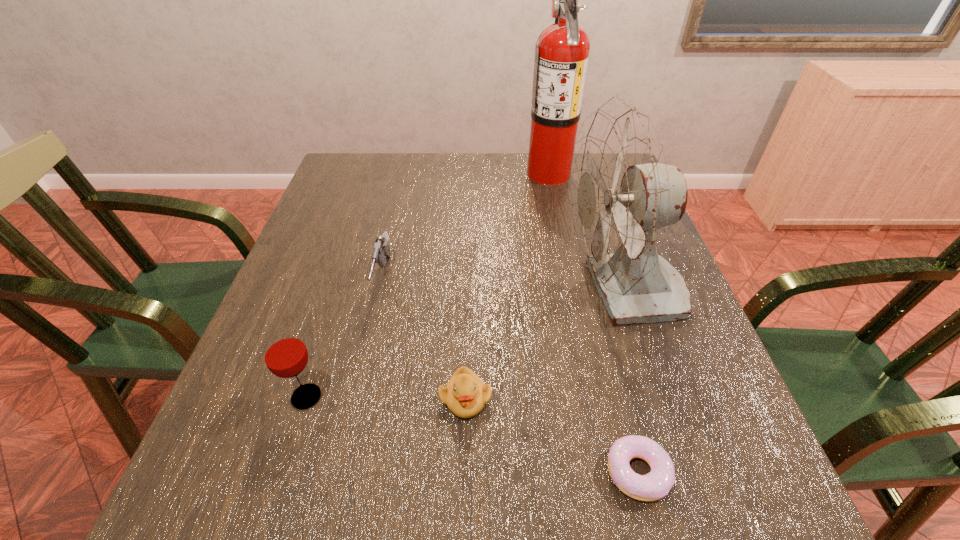
Image resolution: width=960 pixels, height=540 pixels. Identify the location of free space between the third object from left to right and the third shortest object. [424, 339].

Where is `free spot between the doughnut and the fourth tallest object`? free spot between the doughnut and the fourth tallest object is located at coordinates (511, 375).

You are a GUI agent. You are given a task and a screenshot of the screen. Output one action in this format:
    pyautogui.click(x=<x>, y=<y>)
    Task: Click on the second closest object to the doughnut
    This screenshot has width=960, height=540.
    Given the screenshot: What is the action you would take?
    pyautogui.click(x=465, y=394)

Identify which object is located as the second nearest to the doughnut. Please provide its 2D coordinates. Your answer should be formatted as a tuple, i.e. [(x, y)], where the tuple contains the x and y coordinates of a point satisfying the conditions above.

[(465, 394)]

Where is `free location that satisfies the following two spatial constraints: 1. at the beak of the second shortest object; 2. on the left side of the nearest object`? Image resolution: width=960 pixels, height=540 pixels. free location that satisfies the following two spatial constraints: 1. at the beak of the second shortest object; 2. on the left side of the nearest object is located at coordinates (464, 471).

Identify the location of free spot that satisfies the following two spatial constraints: 1. on the nozzle side of the farthest object; 2. on the front side of the fourth shortest object. (596, 397).

This screenshot has height=540, width=960. Find the location of `vacant space that satisfies the following two spatial constraints: 1. at the barrel of the shortest object; 2. on the right side of the fourth tallest object`. vacant space that satisfies the following two spatial constraints: 1. at the barrel of the shortest object; 2. on the right side of the fourth tallest object is located at coordinates (340, 471).

Where is `free spot that satisfies the following two spatial constraints: 1. on the front side of the shortest object; 2. on the left side of the glass`? free spot that satisfies the following two spatial constraints: 1. on the front side of the shortest object; 2. on the left side of the glass is located at coordinates (283, 471).

Locate an element on the screen. Image resolution: width=960 pixels, height=540 pixels. vacant space that satisfies the following two spatial constraints: 1. on the nozzle side of the tallest object; 2. at the barrel of the gun is located at coordinates (571, 279).